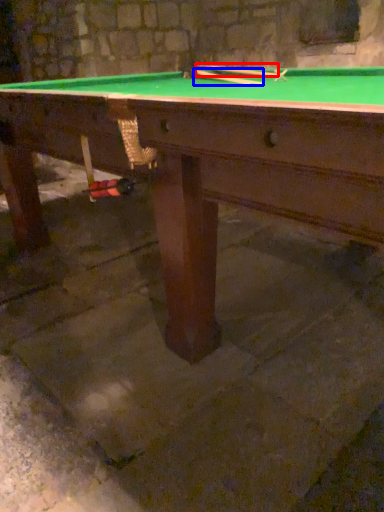
Question: Which object is closer to the camera taking this photo, cue (highlighted by a red box) or cue (highlighted by a blue box)?

Choices:
 (A) cue
 (B) cue

Answer: (B)